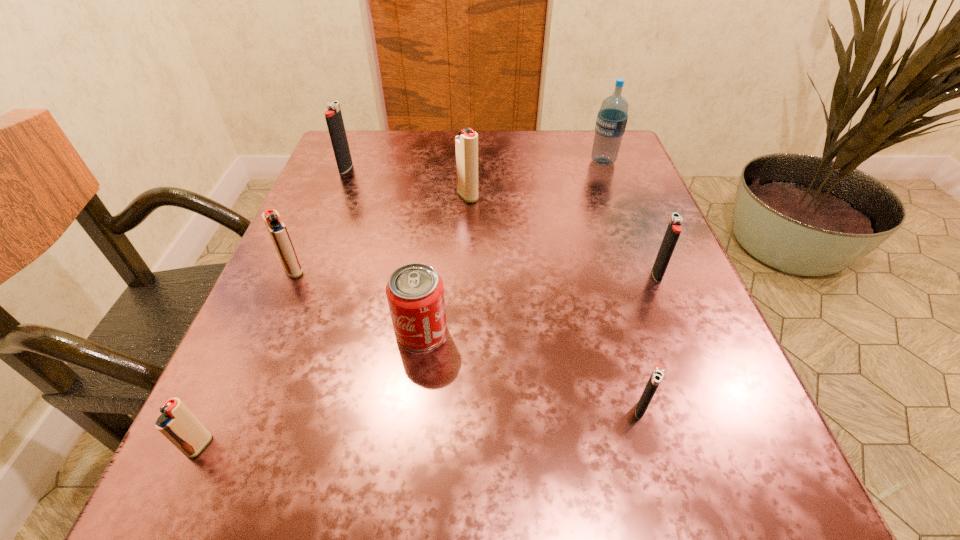
This screenshot has height=540, width=960. In the image, there is a desktop. In order to click on vacant space at the far edge in this screenshot , I will do `click(521, 137)`.

Where is `vacant area at the left edge of the desktop`? This screenshot has width=960, height=540. vacant area at the left edge of the desktop is located at coordinates (296, 321).

Where is `free space at the right edge of the desktop`? free space at the right edge of the desktop is located at coordinates (609, 316).

Identify the location of vacant space at the far left corner of the desktop. pos(386,184).

Locate an element on the screen. This screenshot has height=540, width=960. vacant space at the near left corner of the desktop is located at coordinates (174, 523).

The image size is (960, 540). Find the location of `vacant space at the far right corner of the desktop`. vacant space at the far right corner of the desktop is located at coordinates (624, 154).

I want to click on vacant point located between the second nearest object and the farthest igniter, so click(493, 288).

Identify the location of vacant area that lies between the fourth object from left to right and the second nearest black igniter. Image resolution: width=960 pixels, height=540 pixels. (540, 303).

Locate an element on the screen. This screenshot has height=540, width=960. unoccupied position between the sixth farthest object and the second biggest red igniter is located at coordinates (357, 301).

At what (x,y) coordinates should I click in order to perform the action: click on free area in between the second farthest igniter and the fifth igniter from left to right. Please return your answer as a coordinate pair (x, y). Looking at the image, I should click on (554, 302).